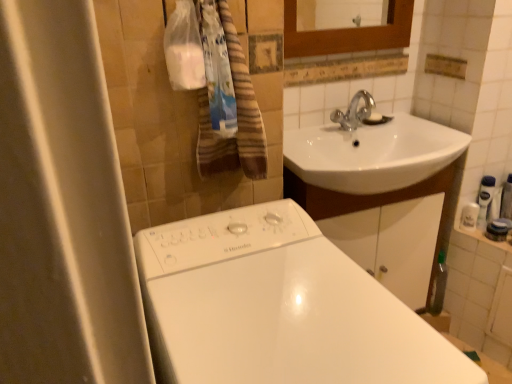
Question: Considering the relative sizes of white plastic soap dispenser at right, which is the 2th toiletry from right to left, and white glossy bathtub at lower center in the image provided, is white plastic soap dispenser at right, which is the 2th toiletry from right to left, shorter than white glossy bathtub at lower center?

Choices:
 (A) yes
 (B) no

Answer: (A)

Question: Considering the relative sizes of white plastic soap dispenser at right, which is the 2th toiletry from right to left, and white glossy bathtub at lower center in the image provided, is white plastic soap dispenser at right, which is the 2th toiletry from right to left, smaller than white glossy bathtub at lower center?

Choices:
 (A) no
 (B) yes

Answer: (B)

Question: Is white plastic soap dispenser at right, acting as the first toiletry starting from the left, looking in the opposite direction of white glossy bathtub at lower center?

Choices:
 (A) yes
 (B) no

Answer: (B)

Question: Is white plastic soap dispenser at right, which is the 2th toiletry from right to left, positioned before white glossy bathtub at lower center?

Choices:
 (A) yes
 (B) no

Answer: (B)

Question: Considering the relative positions of white plastic soap dispenser at right, which is the 2th toiletry from right to left, and white glossy bathtub at lower center in the image provided, is white plastic soap dispenser at right, which is the 2th toiletry from right to left, to the right of white glossy bathtub at lower center from the viewer's perspective?

Choices:
 (A) no
 (B) yes

Answer: (B)

Question: Is white plastic soap dispenser at right, which is the 2th toiletry from right to left, behind white glossy bathtub at lower center?

Choices:
 (A) yes
 (B) no

Answer: (A)

Question: Considering the relative positions of white glossy lotion at right, placed as the 2th toiletry when sorted from left to right, and white glossy bathtub at lower center in the image provided, is white glossy lotion at right, placed as the 2th toiletry when sorted from left to right, to the right of white glossy bathtub at lower center from the viewer's perspective?

Choices:
 (A) yes
 (B) no

Answer: (A)

Question: Does white glossy lotion at right, the first toiletry viewed from the right, lie in front of white glossy bathtub at lower center?

Choices:
 (A) no
 (B) yes

Answer: (A)

Question: Is white glossy lotion at right, the first toiletry viewed from the right, facing away from white glossy bathtub at lower center?

Choices:
 (A) no
 (B) yes

Answer: (A)

Question: Can you confirm if white glossy lotion at right, the first toiletry viewed from the right, is wider than white glossy bathtub at lower center?

Choices:
 (A) no
 (B) yes

Answer: (A)

Question: Can you confirm if white glossy lotion at right, placed as the 2th toiletry when sorted from left to right, is thinner than white glossy bathtub at lower center?

Choices:
 (A) no
 (B) yes

Answer: (B)

Question: From the image's perspective, is white glossy lotion at right, placed as the 2th toiletry when sorted from left to right, located above white glossy bathtub at lower center?

Choices:
 (A) no
 (B) yes

Answer: (B)

Question: Considering the relative sizes of white glossy bathtub at lower center and brown striped towel at upper left in the image provided, is white glossy bathtub at lower center wider than brown striped towel at upper left?

Choices:
 (A) no
 (B) yes

Answer: (B)